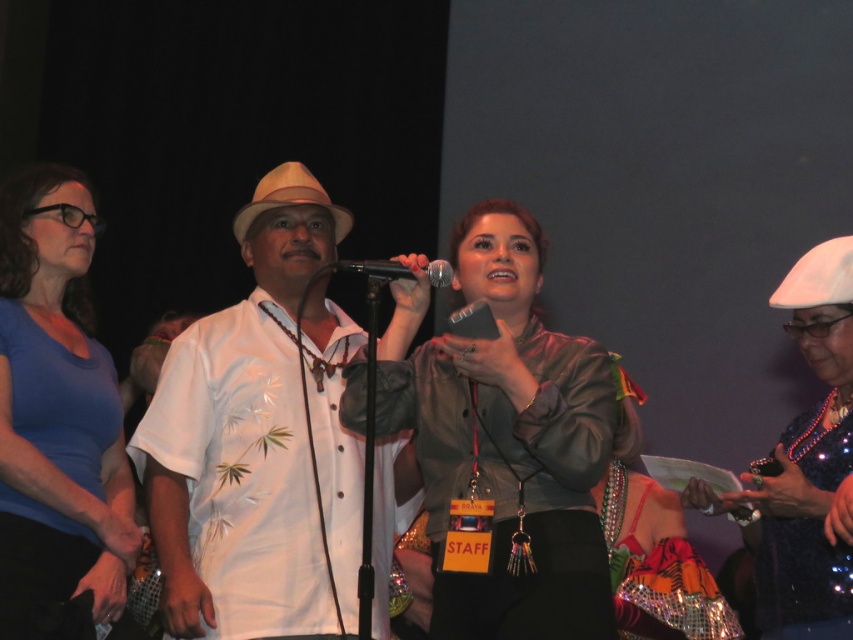
Question: Which point is farther from the camera taking this photo?

Choices:
 (A) (802, 432)
 (B) (115, 554)
 (C) (534, 611)

Answer: (A)

Question: Is white matte shirt at center wider than shiny black microphone at center?

Choices:
 (A) no
 (B) yes

Answer: (B)

Question: Which of these objects is positioned farthest from the white matte shirt at center?

Choices:
 (A) blue matte shirt at left
 (B) shiny black microphone at center
 (C) sparkly blue dress at center
 (D) shiny metallic jacket at center

Answer: (C)

Question: Does blue matte shirt at left have a greater width compared to sparkly blue dress at center?

Choices:
 (A) yes
 (B) no

Answer: (B)

Question: Considering the real-world distances, which object is closest to the sparkly blue dress at center?

Choices:
 (A) shiny metallic jacket at center
 (B) blue matte shirt at left

Answer: (A)

Question: Does sparkly blue dress at center appear under shiny black microphone at center?

Choices:
 (A) no
 (B) yes

Answer: (B)